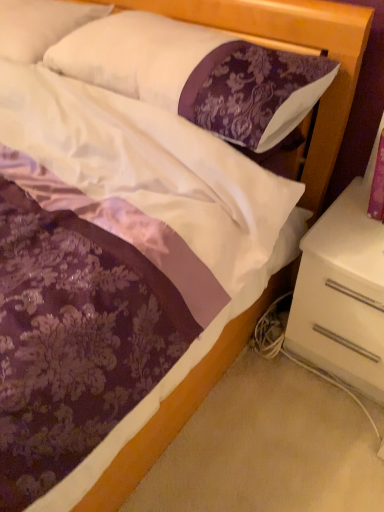
Measure the distance between point (x=293, y=85) and camera.

A distance of 38.31 inches exists between point (x=293, y=85) and camera.

Measure the distance between point (370,319) and camera.

A distance of 3.73 feet exists between point (370,319) and camera.

This screenshot has width=384, height=512. Describe the element at coordinates (342, 294) in the screenshot. I see `white glossy nightstand at lower right` at that location.

Where is `purple damask pillow at upper center, acting as the first pillow starting from the right`? Image resolution: width=384 pixels, height=512 pixels. purple damask pillow at upper center, acting as the first pillow starting from the right is located at coordinates (x=197, y=74).

Which is more to the right, white soft pillow at upper left, the second pillow positioned from the right, or purple damask pillow at upper center, acting as the first pillow starting from the right?

Positioned to the right is purple damask pillow at upper center, acting as the first pillow starting from the right.

Which object is wider, white soft pillow at upper left, the 1th pillow from the left, or purple damask pillow at upper center, acting as the first pillow starting from the right?

white soft pillow at upper left, the 1th pillow from the left, is wider.

From a real-world perspective, is white soft pillow at upper left, the second pillow positioned from the right, physically located above or below purple damask pillow at upper center, the 2th pillow when ordered from left to right?

white soft pillow at upper left, the second pillow positioned from the right, is below purple damask pillow at upper center, the 2th pillow when ordered from left to right.

Which is behind, point (355, 306) or point (44, 35)?

The point (44, 35) is farther from the camera.

From the image's perspective, is white glossy nightstand at lower right located above white soft pillow at upper left, the 1th pillow from the left?

Actually, white glossy nightstand at lower right appears below white soft pillow at upper left, the 1th pillow from the left, in the image.

Consider the image. Is the surface of white glossy nightstand at lower right in direct contact with white soft pillow at upper left, the 1th pillow from the left?

No, white glossy nightstand at lower right is not touching white soft pillow at upper left, the 1th pillow from the left.

From a real-world perspective, relative to white soft pillow at upper left, the 1th pillow from the left, is white glossy nightstand at lower right vertically above or below?

In terms of real-world spatial position, white glossy nightstand at lower right is below white soft pillow at upper left, the 1th pillow from the left.

From a real-world perspective, which is physically above, purple damask pillow at upper center, acting as the first pillow starting from the right, or white glossy nightstand at lower right?

In real-world perspective, purple damask pillow at upper center, acting as the first pillow starting from the right, is above.

Considering the positions of point (266, 149) and point (361, 327), is point (266, 149) closer or farther from the camera than point (361, 327)?

Point (266, 149).

Is purple damask pillow at upper center, acting as the first pillow starting from the right, spatially inside white glossy nightstand at lower right, or outside of it?

purple damask pillow at upper center, acting as the first pillow starting from the right, is not inside white glossy nightstand at lower right, it's outside.

This screenshot has height=512, width=384. In order to click on nightstand below the purple damask pillow at upper center, the 2th pillow when ordered from left to right (from the image's perspective) in this screenshot , I will do `click(342, 294)`.

Does white glossy nightstand at lower right lie in front of purple damask pillow at upper center, the 2th pillow when ordered from left to right?

No, it is not.

Considering the positions of objects white glossy nightstand at lower right and purple damask pillow at upper center, acting as the first pillow starting from the right, in the image provided, who is more to the right, white glossy nightstand at lower right or purple damask pillow at upper center, acting as the first pillow starting from the right,?

white glossy nightstand at lower right.

From a real-world perspective, is white glossy nightstand at lower right physically located above or below purple damask pillow at upper center, acting as the first pillow starting from the right?

Answer: In terms of real-world spatial position, white glossy nightstand at lower right is below purple damask pillow at upper center, acting as the first pillow starting from the right.

Is white glossy nightstand at lower right taller or shorter than purple damask pillow at upper center, acting as the first pillow starting from the right?

Clearly, white glossy nightstand at lower right is taller compared to purple damask pillow at upper center, acting as the first pillow starting from the right.

Is white soft pillow at upper left, the second pillow positioned from the right, not inside white glossy nightstand at lower right?

white soft pillow at upper left, the second pillow positioned from the right, is positioned outside white glossy nightstand at lower right.

From a real-world perspective, which is physically below, white soft pillow at upper left, the second pillow positioned from the right, or white glossy nightstand at lower right?

From a 3D spatial view, white glossy nightstand at lower right is below.

How different are the orientations of white soft pillow at upper left, the second pillow positioned from the right, and white glossy nightstand at lower right in degrees?

There is a 1.4-degree angle between the facing directions of white soft pillow at upper left, the second pillow positioned from the right, and white glossy nightstand at lower right.

Considering the positions of points (32, 24) and (364, 354), is point (32, 24) closer to camera compared to point (364, 354)?

No, it is behind (364, 354).

Does purple damask pillow at upper center, acting as the first pillow starting from the right, appear on the left side of white soft pillow at upper left, the 1th pillow from the left?

In fact, purple damask pillow at upper center, acting as the first pillow starting from the right, is to the right of white soft pillow at upper left, the 1th pillow from the left.

From a real-world perspective, is purple damask pillow at upper center, the 2th pillow when ordered from left to right, above or below white soft pillow at upper left, the 1th pillow from the left?

Clearly, from a real-world perspective, purple damask pillow at upper center, the 2th pillow when ordered from left to right, is above white soft pillow at upper left, the 1th pillow from the left.

From the image's perspective, is purple damask pillow at upper center, the 2th pillow when ordered from left to right, above or below white soft pillow at upper left, the second pillow positioned from the right?

Based on their image positions, purple damask pillow at upper center, the 2th pillow when ordered from left to right, is located beneath white soft pillow at upper left, the second pillow positioned from the right.

Where is `pillow located below the white soft pillow at upper left, the 1th pillow from the left (from the image's perspective)`? The width and height of the screenshot is (384, 512). pillow located below the white soft pillow at upper left, the 1th pillow from the left (from the image's perspective) is located at coordinates (197, 74).

The height and width of the screenshot is (512, 384). What are the coordinates of `pillow behind the white glossy nightstand at lower right` in the screenshot? It's located at (40, 25).

Looking at the image, which one is located closer to white glossy nightstand at lower right, white soft pillow at upper left, the 1th pillow from the left, or purple damask pillow at upper center, the 2th pillow when ordered from left to right?

purple damask pillow at upper center, the 2th pillow when ordered from left to right, is closer to white glossy nightstand at lower right.

From the image, which object appears to be nearer to purple damask pillow at upper center, acting as the first pillow starting from the right, white soft pillow at upper left, the 1th pillow from the left, or white glossy nightstand at lower right?

white soft pillow at upper left, the 1th pillow from the left, lies closer to purple damask pillow at upper center, acting as the first pillow starting from the right, than the other object.

Considering their positions, is white glossy nightstand at lower right positioned closer to white soft pillow at upper left, the 1th pillow from the left, than purple damask pillow at upper center, the 2th pillow when ordered from left to right?

The object closer to white soft pillow at upper left, the 1th pillow from the left, is purple damask pillow at upper center, the 2th pillow when ordered from left to right.

Which object lies nearer to the anchor point white glossy nightstand at lower right, purple damask pillow at upper center, acting as the first pillow starting from the right, or white soft pillow at upper left, the second pillow positioned from the right?

The object closer to white glossy nightstand at lower right is purple damask pillow at upper center, acting as the first pillow starting from the right.

Estimate the real-world distances between objects in this image. Which object is closer to white soft pillow at upper left, the second pillow positioned from the right, purple damask pillow at upper center, the 2th pillow when ordered from left to right, or white glossy nightstand at lower right?

Among the two, purple damask pillow at upper center, the 2th pillow when ordered from left to right, is located nearer to white soft pillow at upper left, the second pillow positioned from the right.

Looking at the image, which one is located closer to purple damask pillow at upper center, the 2th pillow when ordered from left to right, white glossy nightstand at lower right or white soft pillow at upper left, the 1th pillow from the left?

The object closer to purple damask pillow at upper center, the 2th pillow when ordered from left to right, is white soft pillow at upper left, the 1th pillow from the left.

Where is `pillow between white soft pillow at upper left, the 1th pillow from the left, and white glossy nightstand at lower right from left to right`? This screenshot has width=384, height=512. pillow between white soft pillow at upper left, the 1th pillow from the left, and white glossy nightstand at lower right from left to right is located at coordinates click(197, 74).